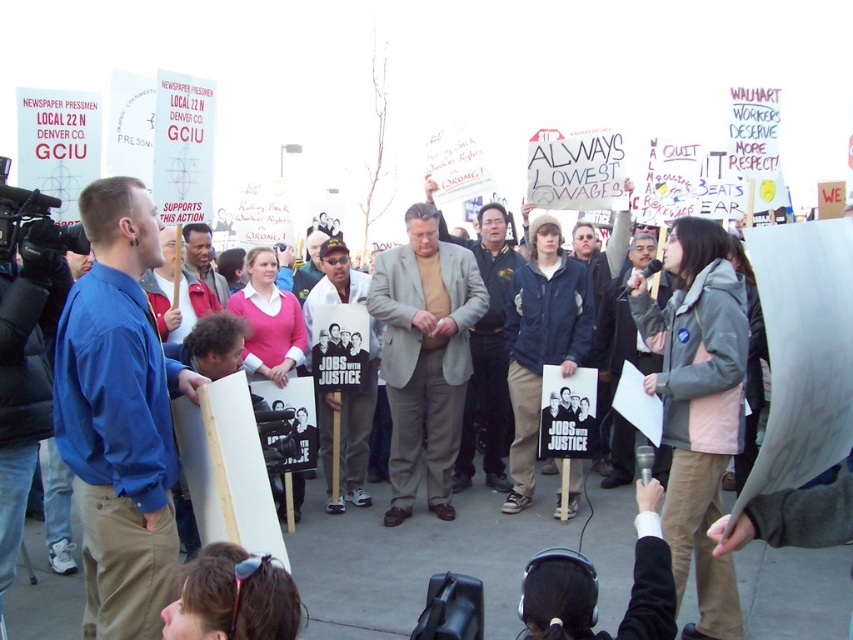
Question: From the image, what is the correct spatial relationship of blue cotton shirt at left in relation to reddish-brown leather jacket at center?

Choices:
 (A) left
 (B) right

Answer: (B)

Question: Which of the following is the closest to the observer?

Choices:
 (A) (373, 266)
 (B) (186, 237)

Answer: (B)

Question: Does white cotton shirt at center have a lesser width compared to reddish-brown leather jacket at center?

Choices:
 (A) yes
 (B) no

Answer: (B)

Question: Which point is farther from the camera taking this photo?

Choices:
 (A) (492, 208)
 (B) (309, 300)
 (C) (105, 385)
 (D) (189, 268)

Answer: (A)

Question: Which of the following is the farthest from the observer?

Choices:
 (A) (469, 259)
 (B) (318, 410)

Answer: (A)

Question: Can you confirm if blue cotton shirt at left is thinner than reddish-brown leather jacket at center?

Choices:
 (A) yes
 (B) no

Answer: (B)